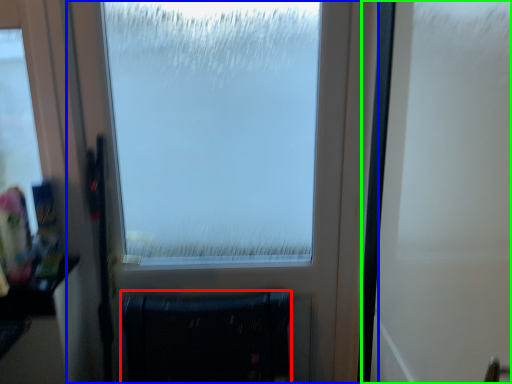
Question: Based on their relative distances, which object is nearer to furniture (highlighted by a red box)? Choose from window (highlighted by a blue box) and screen door (highlighted by a green box).

Choices:
 (A) window
 (B) screen door

Answer: (A)